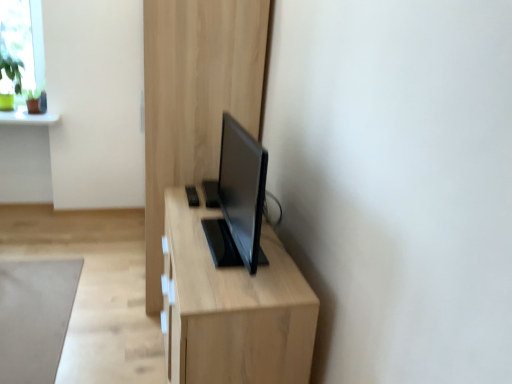
Question: Is light wood dresser at center bigger or smaller than light wood table at center?

Choices:
 (A) small
 (B) big

Answer: (B)

Question: Considering the positions of point (165, 39) and point (238, 339), is point (165, 39) closer or farther from the camera than point (238, 339)?

Choices:
 (A) farther
 (B) closer

Answer: (A)

Question: Which object is positioned farthest from the light wood dresser at center?

Choices:
 (A) light wood table at center
 (B) gray matte rug at lower left

Answer: (B)

Question: Which is farther from the gray matte rug at lower left?

Choices:
 (A) light wood dresser at center
 (B) light wood table at center

Answer: (B)